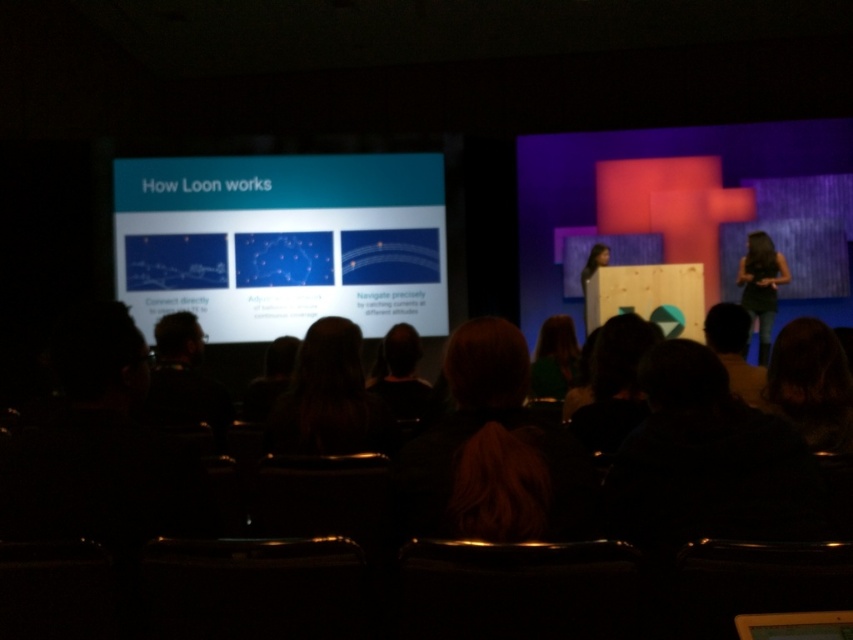
Who is taller, dark brown hair at center or matte black dress at center?

matte black dress at center is taller.

Looking at this image, is dark brown hair at center positioned before matte black dress at center?

That is True.

Does point (563, 378) come behind point (595, 262)?

No.

The width and height of the screenshot is (853, 640). Identify the location of dark brown hair at center. (554, 358).

Is point (325, 278) farther from camera compared to point (753, 300)?

Yes, it is behind point (753, 300).

Between point (183, 273) and point (747, 273), which one is positioned in front?

Point (747, 273)

Where is `white glossy projector screen at upper left`? The image size is (853, 640). white glossy projector screen at upper left is located at coordinates (282, 241).

Between point (228, 248) and point (544, 352), which one is positioned behind?

The point (228, 248) is more distant.

You are a GUI agent. You are given a task and a screenshot of the screen. Output one action in this format:
    pyautogui.click(x=<x>, y=<y>)
    Task: Click on the white glossy projector screen at upper left
    
    Given the screenshot: What is the action you would take?
    (x=282, y=241)